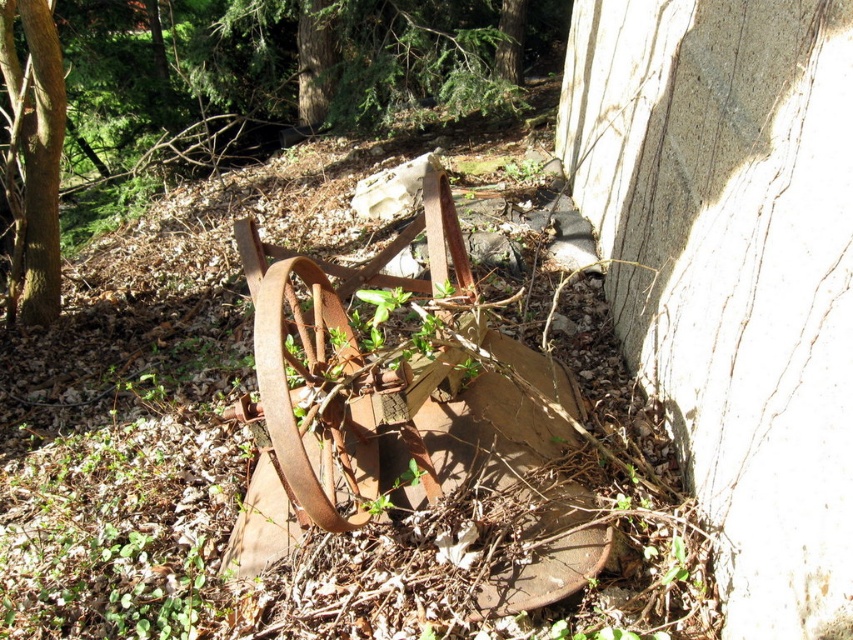
Question: Estimate the real-world distances between objects in this image. Which object is farther from the rusty metal cart at center?

Choices:
 (A) green rough bark tree at left
 (B) green matte tree at upper center

Answer: (A)

Question: In this image, where is rusty metal cart at center located relative to green matte tree at upper center?

Choices:
 (A) right
 (B) left

Answer: (B)

Question: Which object appears closest to the camera in this image?

Choices:
 (A) rusty metal cart at center
 (B) green rough bark tree at left
 (C) green matte tree at upper center

Answer: (B)

Question: Which object is positioned farthest from the green rough bark tree at left?

Choices:
 (A) rusty metal wagon wheel at center
 (B) rusty metal cart at center
 (C) green matte tree at upper center

Answer: (C)

Question: Does rusty metal cart at center have a lesser width compared to green matte tree at upper center?

Choices:
 (A) yes
 (B) no

Answer: (B)

Question: In this image, where is green rough bark tree at left located relative to green matte tree at upper center?

Choices:
 (A) left
 (B) right

Answer: (A)